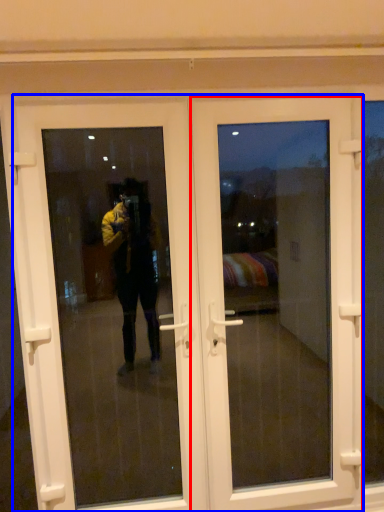
Question: Which object appears closest to the camera in this image, door (highlighted by a red box) or door (highlighted by a blue box)?

Choices:
 (A) door
 (B) door

Answer: (B)